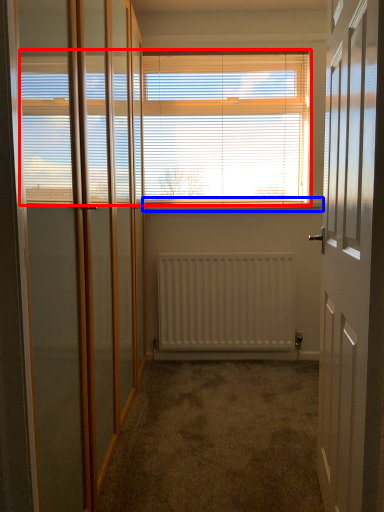
Question: Which of the following is the farthest to the observer, window blind (highlighted by a red box) or window sill (highlighted by a blue box)?

Choices:
 (A) window blind
 (B) window sill

Answer: (B)